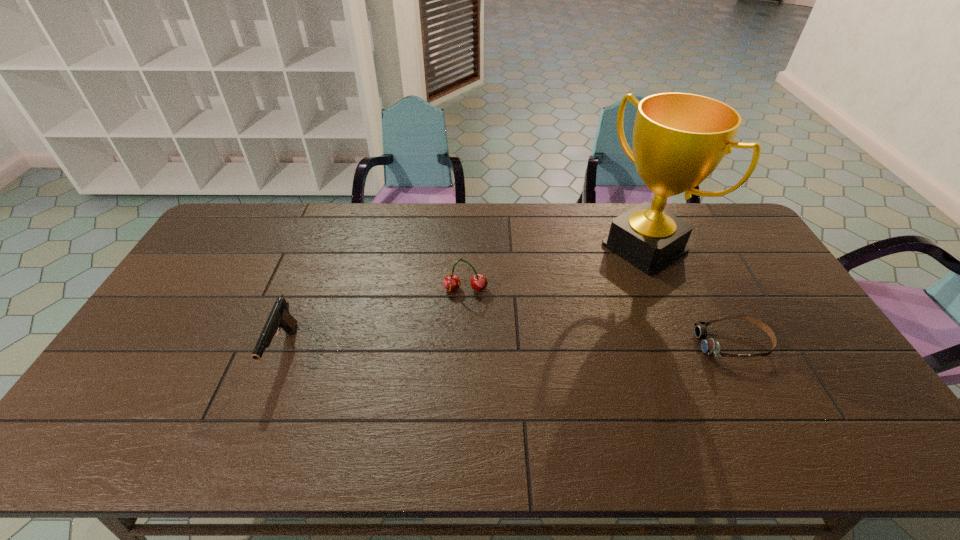
The height and width of the screenshot is (540, 960). I want to click on vacant space located with stems pointing upwards on the third object from right to left, so click(464, 318).

You are a GUI agent. You are given a task and a screenshot of the screen. Output one action in this format:
    pyautogui.click(x=<x>, y=<y>)
    Task: Click on the free spot located on the front-facing side of the tallest object
    The height and width of the screenshot is (540, 960).
    Given the screenshot: What is the action you would take?
    (531, 324)

The width and height of the screenshot is (960, 540). What are the coordinates of `vacant space located on the front-facing side of the tallest object` in the screenshot? It's located at (543, 316).

This screenshot has height=540, width=960. In order to click on vacant space situated 0.090m on the front-facing side of the tallest object in this screenshot , I will do `click(600, 280)`.

You are a GUI agent. You are given a task and a screenshot of the screen. Output one action in this format:
    pyautogui.click(x=<x>, y=<y>)
    Task: Click on the object located at the far edge
    Image resolution: width=960 pixels, height=540 pixels.
    Given the screenshot: What is the action you would take?
    pyautogui.click(x=679, y=139)

Identify the location of object that is at the near edge. This screenshot has width=960, height=540. (279, 317).

I want to click on object positioned at the right edge, so click(x=710, y=347).

I want to click on free point at the far edge, so click(511, 205).

Image resolution: width=960 pixels, height=540 pixels. Identify the location of free space at the near edge of the desktop. (475, 398).

At what (x,y) coordinates should I click in order to perform the action: click on free space at the far left corner. Please return your answer as a coordinate pair (x, y). Image resolution: width=960 pixels, height=540 pixels. Looking at the image, I should click on (243, 217).